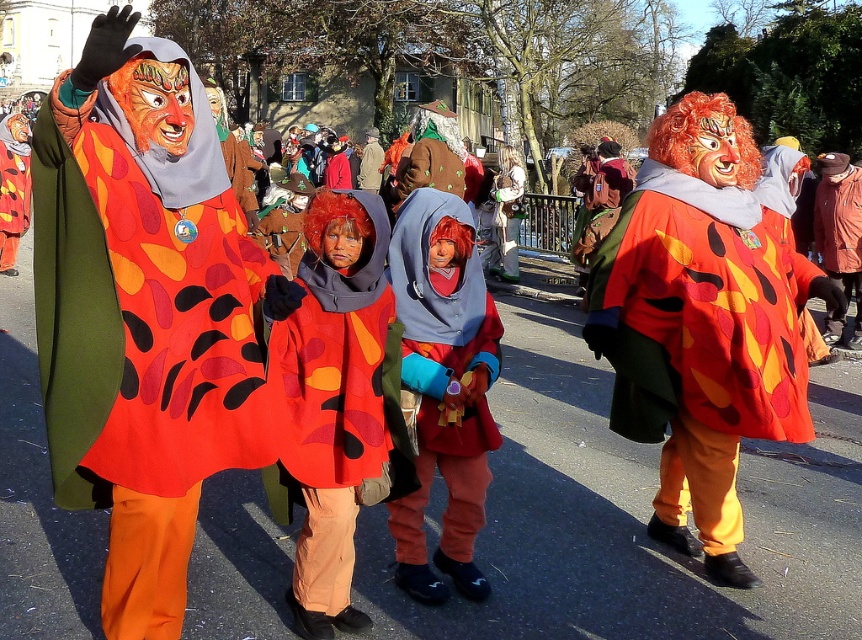
Is flame-patterned fabric joker at center bigger than matte fabric costume at center?

Yes, flame-patterned fabric joker at center is bigger than matte fabric costume at center.

Is point (692, 454) in front of point (373, 220)?

No, (692, 454) is further to viewer.

Image resolution: width=862 pixels, height=640 pixels. What are the coordinates of `flame-patterned fabric joker at center` in the screenshot? It's located at (701, 324).

Does matte fabric costume at center lie behind matte red cape at center?

No, it is not.

Does point (384, 282) come behind point (400, 586)?

No, it is in front of (400, 586).

In order to click on matte fabric costume at center in this screenshot , I will do `click(336, 403)`.

Measure the distance between point (673, 490) and camera.

Point (673, 490) is 4.17 meters away from camera.

Which is more to the right, flame-patterned fabric joker at center or matte red cape at center?

From the viewer's perspective, flame-patterned fabric joker at center appears more on the right side.

Which is behind, point (661, 216) or point (416, 544)?

The point (661, 216) is more distant.

Identify the location of flame-patterned fabric joker at center. (701, 324).